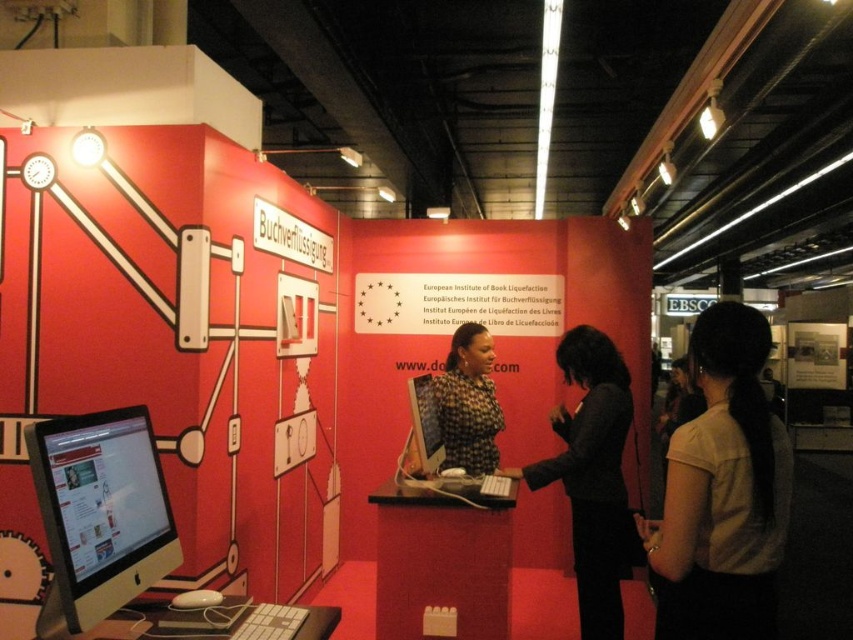
Which is above, dark brown leather jacket at center or matte black monitor at center?

matte black monitor at center is higher up.

You are a GUI agent. You are given a task and a screenshot of the screen. Output one action in this format:
    pyautogui.click(x=<x>, y=<y>)
    Task: Click on the dark brown leather jacket at center
    The image size is (853, 640).
    Given the screenshot: What is the action you would take?
    pyautogui.click(x=592, y=476)

Identify the location of dark brown leather jacket at center. The height and width of the screenshot is (640, 853). (592, 476).

Is white fabric shirt at right behind matte black monitor at center?

No.

Is white fabric shirt at right wider than matte black monitor at center?

Correct, the width of white fabric shirt at right exceeds that of matte black monitor at center.

Is point (703, 390) in front of point (424, 461)?

Yes, point (703, 390) is closer to viewer.

Locate an element on the screen. The image size is (853, 640). white fabric shirt at right is located at coordinates (723, 492).

Measure the distance between point [456,403] and camera.

Point [456,403] and camera are 3.74 meters apart.

In the scene shown: Who is more forward, (440, 433) or (440, 433)?

Point (440, 433) is in front.

At what (x,y) coordinates should I click in order to perform the action: click on matte black dress at center. Please return your answer as a coordinate pair (x, y). The height and width of the screenshot is (640, 853). Looking at the image, I should click on (x=468, y=403).